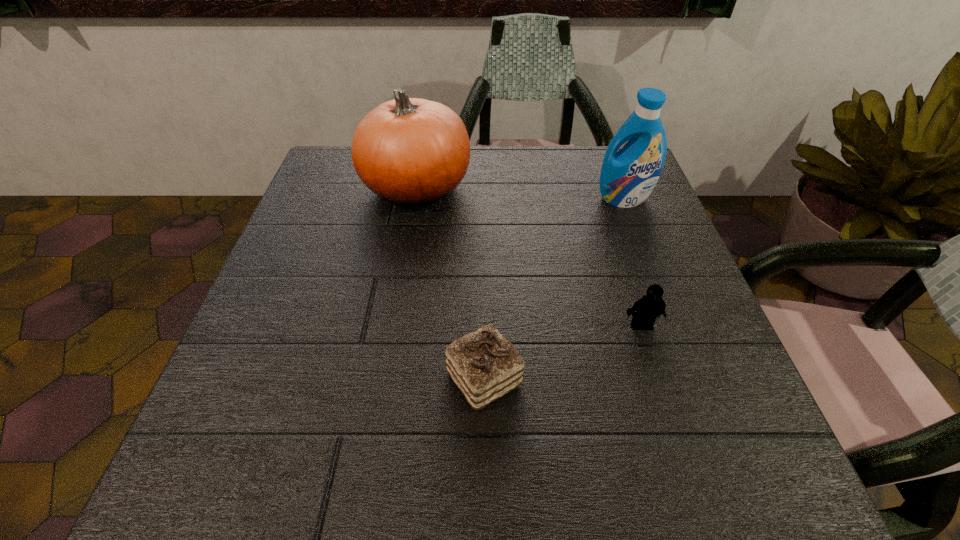
Where is `free area in between the shortest object and the pumpkin`? free area in between the shortest object and the pumpkin is located at coordinates (450, 283).

The width and height of the screenshot is (960, 540). What are the coordinates of `vacant area between the detergent and the shortest object` in the screenshot? It's located at (554, 288).

The image size is (960, 540). Find the location of `the third closest object to the detergent`. the third closest object to the detergent is located at coordinates (484, 365).

Locate an element on the screen. The height and width of the screenshot is (540, 960). object that can be found as the third closest to the Lego is located at coordinates (413, 152).